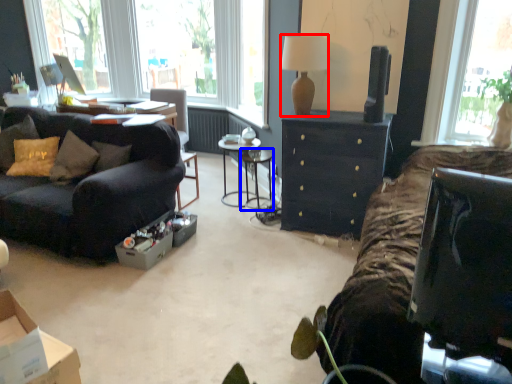
Question: Among these objects, which one is nearest to the camera, lamp (highlighted by a red box) or table (highlighted by a blue box)?

Choices:
 (A) lamp
 (B) table

Answer: (A)